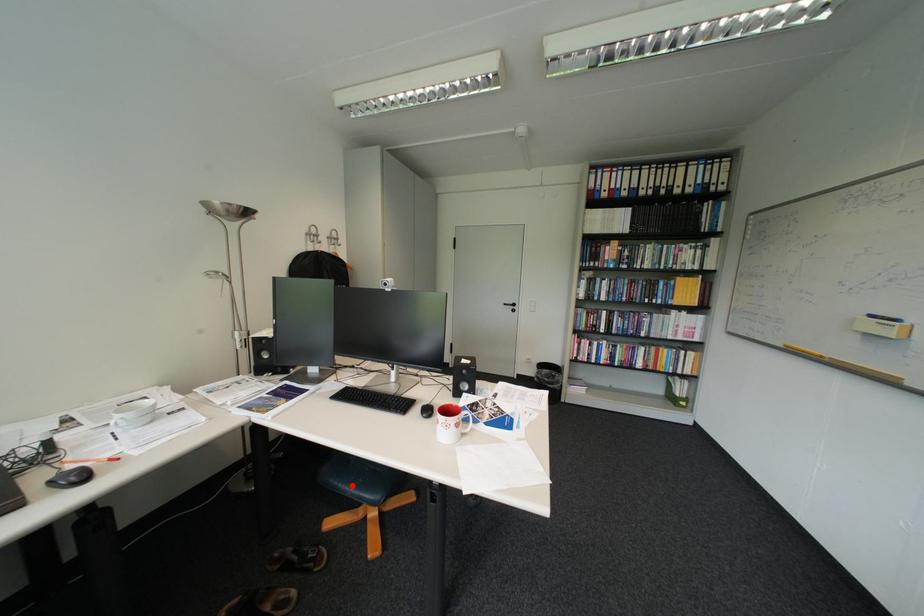
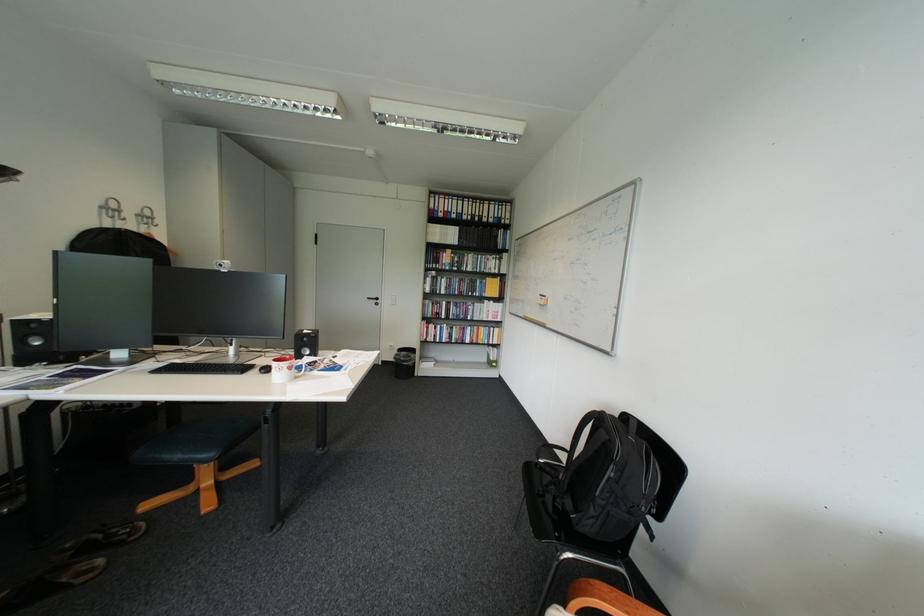
Locate, in the second image, the point that corresponds to the highlighted location in the first image.

(176, 456)